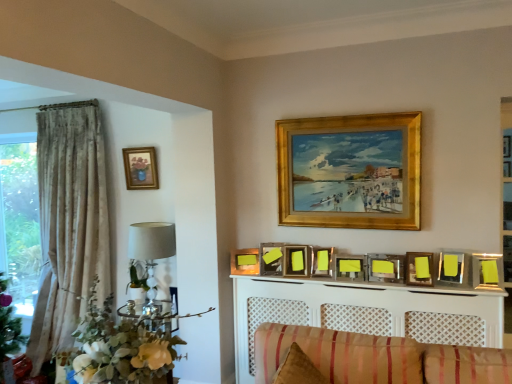
Question: Is green leafy floral arrangement at left inside the boundaries of yellow matte picture frame at center, the seventh picture frame positioned from the left, or outside?

Choices:
 (A) outside
 (B) inside

Answer: (A)

Question: Is green leafy floral arrangement at left taller or shorter than yellow matte picture frame at center, arranged as the 5th picture frame when viewed from the right?

Choices:
 (A) tall
 (B) short

Answer: (A)

Question: Which of these objects is positioned closest to the matte wood picture frame at upper center, the eighth picture frame in the right-to-left sequence?

Choices:
 (A) matte yellow picture frame at center, which appears as the tenth picture frame when viewed from the right
 (B) yellow matte picture frame at center, which ranks as the 5th picture frame in left-to-right order
 (C) gold wooden picture frame at upper center, the sixth picture frame from the left
 (D) yellow matte picture frame at center, which is the third picture frame in right-to-left order
 (E) white fabric lampshade at left

Answer: (B)

Question: Which is nearer to the yellow matte picture frame at center, which is the ninth picture frame from left to right?

Choices:
 (A) yellow matte picture frame at upper center, the first picture frame positioned from the right
 (B) matte yellow picture frame at center, which appears as the tenth picture frame when viewed from the right
 (C) yellow matte picture frame at upper center, which ranks as the second picture frame in right-to-left order
 (D) green leafy floral arrangement at left
 (E) yellow matte picture frame at center, which ranks as the 5th picture frame in left-to-right order

Answer: (C)